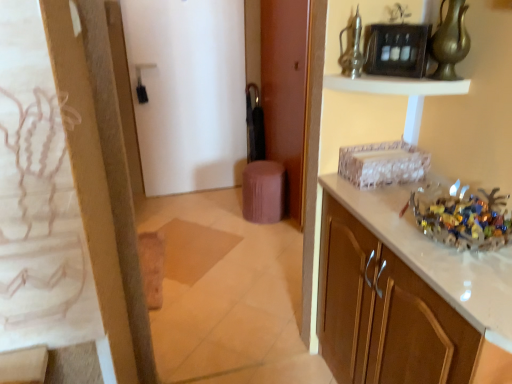
At what (x,y) coordinates should I click in order to perform the action: click on free space in front of purple fabric stool at center. Please return your answer as a coordinate pair (x, y). The height and width of the screenshot is (384, 512). Looking at the image, I should click on (259, 238).